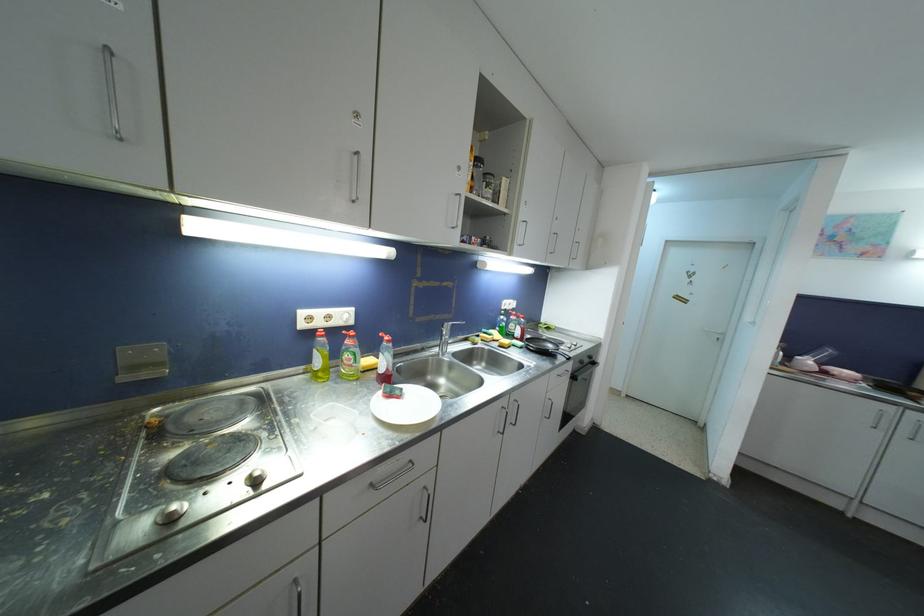
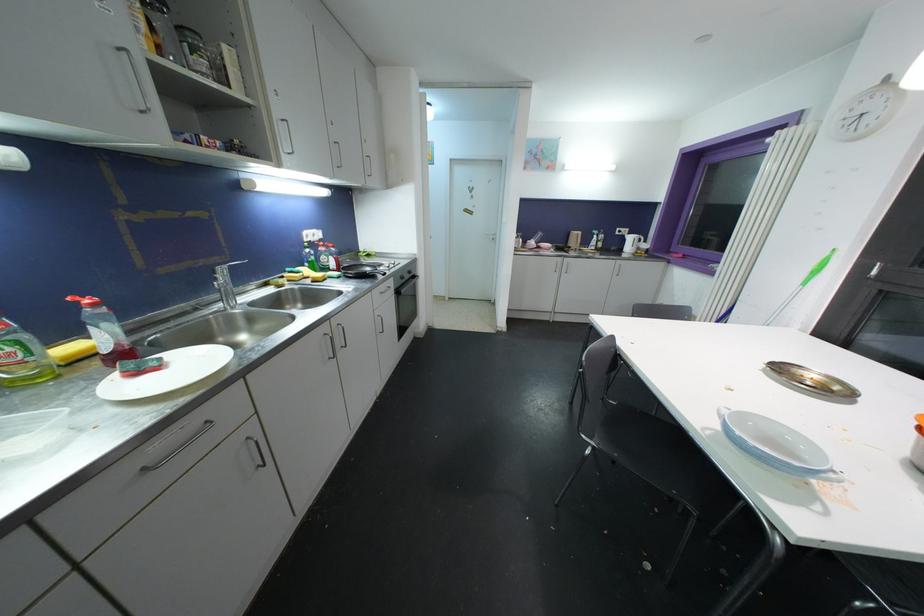
Locate, in the second image, the point that corresponds to point 592,360 in the first image.

(412, 275)